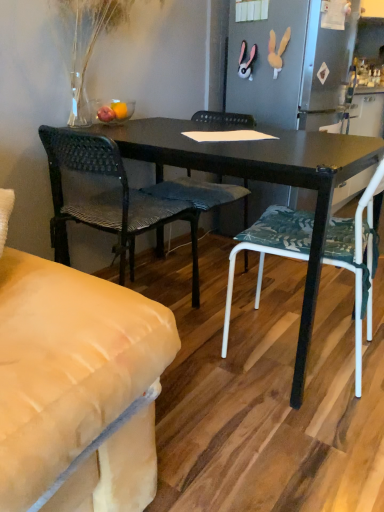
Question: Is white fabric chair at center, arranged as the 1th chair when viewed from the right, positioned behind woven fabric chair at center, arranged as the 2th chair when viewed from the right?

Choices:
 (A) yes
 (B) no

Answer: (B)

Question: Can you confirm if white fabric chair at center, arranged as the 1th chair when viewed from the right, is shorter than woven fabric chair at center, arranged as the 2th chair when viewed from the right?

Choices:
 (A) no
 (B) yes

Answer: (A)

Question: Is white fabric chair at center, arranged as the 1th chair when viewed from the right, positioned in front of woven fabric chair at center, arranged as the 2th chair when viewed from the right?

Choices:
 (A) no
 (B) yes

Answer: (B)

Question: Is white fabric chair at center, arranged as the 1th chair when viewed from the right, oriented away from woven fabric chair at center, placed as the second chair when sorted from left to right?

Choices:
 (A) yes
 (B) no

Answer: (B)

Question: Is white fabric chair at center, arranged as the 1th chair when viewed from the right, next to woven fabric chair at center, arranged as the 2th chair when viewed from the right, and touching it?

Choices:
 (A) no
 (B) yes

Answer: (A)

Question: From a real-world perspective, relative to woven fabric chair at center, which is the 1th chair from left to right, is white fabric chair at center, arranged as the 1th chair when viewed from the right, vertically above or below?

Choices:
 (A) below
 (B) above

Answer: (B)

Question: From the image's perspective, relative to woven fabric chair at center, the third chair in the right-to-left sequence, is white fabric chair at center, arranged as the 1th chair when viewed from the right, above or below?

Choices:
 (A) above
 (B) below

Answer: (B)

Question: Looking at their shapes, would you say white fabric chair at center, arranged as the 3th chair when viewed from the left, is wider or thinner than woven fabric chair at center, the third chair in the right-to-left sequence?

Choices:
 (A) wide
 (B) thin

Answer: (A)

Question: In terms of size, does white fabric chair at center, arranged as the 1th chair when viewed from the right, appear bigger or smaller than woven fabric chair at center, which is the 1th chair from left to right?

Choices:
 (A) big
 (B) small

Answer: (A)

Question: Based on their sizes in the image, would you say woven fabric chair at center, placed as the second chair when sorted from left to right, is bigger or smaller than white fabric chair at center, arranged as the 1th chair when viewed from the right?

Choices:
 (A) small
 (B) big

Answer: (A)

Question: From a real-world perspective, is woven fabric chair at center, arranged as the 2th chair when viewed from the right, above or below white fabric chair at center, arranged as the 1th chair when viewed from the right?

Choices:
 (A) below
 (B) above

Answer: (A)

Question: Is woven fabric chair at center, placed as the second chair when sorted from left to right, taller or shorter than white fabric chair at center, arranged as the 3th chair when viewed from the left?

Choices:
 (A) short
 (B) tall

Answer: (A)

Question: Looking at their shapes, would you say woven fabric chair at center, placed as the second chair when sorted from left to right, is wider or thinner than white fabric chair at center, arranged as the 3th chair when viewed from the left?

Choices:
 (A) wide
 (B) thin

Answer: (A)

Question: Considering the relative positions of woven fabric chair at center, the third chair in the right-to-left sequence, and white fabric chair at center, arranged as the 1th chair when viewed from the right, in the image provided, is woven fabric chair at center, the third chair in the right-to-left sequence, to the left or to the right of white fabric chair at center, arranged as the 1th chair when viewed from the right,?

Choices:
 (A) left
 (B) right

Answer: (A)

Question: From the image's perspective, is woven fabric chair at center, the third chair in the right-to-left sequence, located above or below white fabric chair at center, arranged as the 1th chair when viewed from the right?

Choices:
 (A) below
 (B) above

Answer: (B)